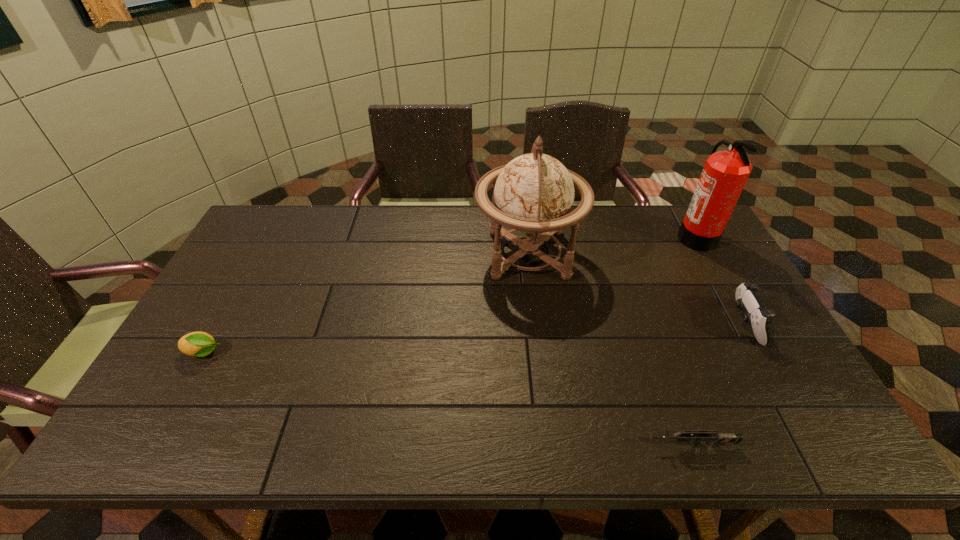
Find the location of `globe`. globe is located at coordinates (534, 193).

The image size is (960, 540). Identify the location of fire extinguisher. (725, 173).

This screenshot has height=540, width=960. What are the coordinates of `control` in the screenshot? It's located at click(747, 299).

Where is `the second shortest object`? This screenshot has width=960, height=540. the second shortest object is located at coordinates tap(200, 344).

Find the location of `lemon`. lemon is located at coordinates (200, 344).

Locate an element on the screen. Image resolution: width=960 pixels, height=540 pixels. the shortest object is located at coordinates [x=717, y=438].

You are a GUI agent. You are given a task and a screenshot of the screen. Output one action in this format:
    pyautogui.click(x=<x>, y=<y>)
    Task: Click on the nearest object
    
    Given the screenshot: What is the action you would take?
    pyautogui.click(x=717, y=438)

The width and height of the screenshot is (960, 540). I want to click on free spot located 0.080m at the front of the globe showing Africa, so click(x=450, y=254).

Identify the location of blank space located 0.300m at the front of the globe showing Africa. Image resolution: width=960 pixels, height=540 pixels. (383, 254).

You are a GUI agent. You are given a task and a screenshot of the screen. Output one action in this format:
    pyautogui.click(x=<x>, y=<y>)
    Task: Click on the free space located at the front of the globe showing Africa
    
    Given the screenshot: What is the action you would take?
    click(405, 254)